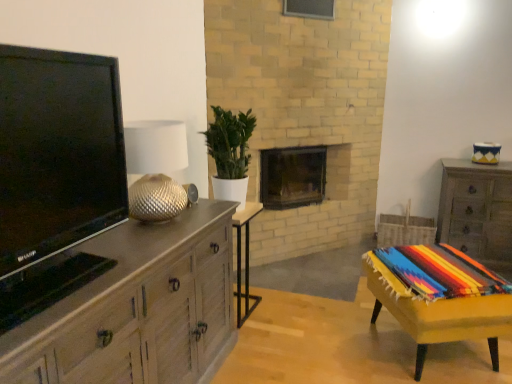
This screenshot has width=512, height=384. Identify the location of vacant area located to the right-hand side of gold textured lampshade at left. [201, 220].